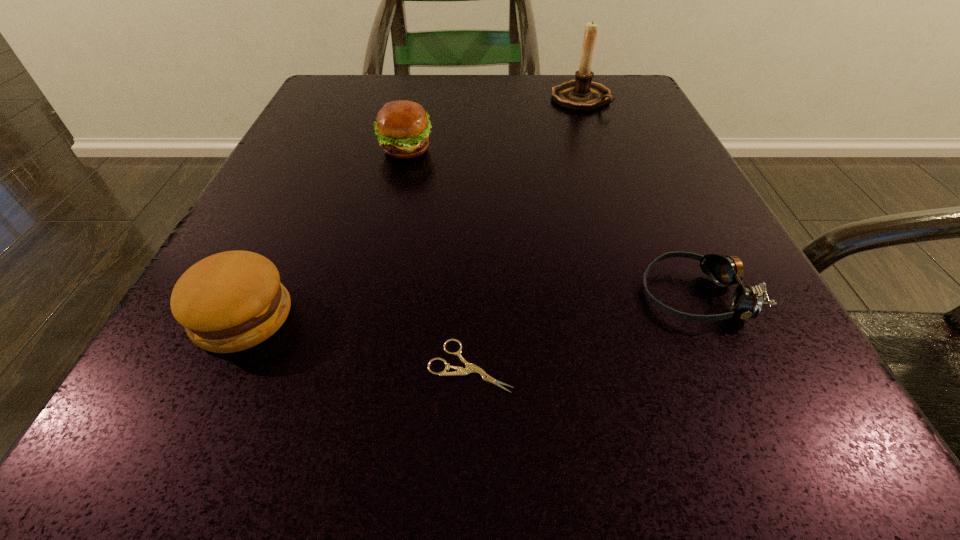
Image resolution: width=960 pixels, height=540 pixels. Identify the location of the tallest object. (581, 94).

In order to click on the farthest object in this screenshot , I will do (x=581, y=94).

You are a GUI agent. You are given a task and a screenshot of the screen. Output one action in this format:
    pyautogui.click(x=<x>, y=<y>)
    Task: Click on the second farthest object
    
    Given the screenshot: What is the action you would take?
    pyautogui.click(x=402, y=126)

Where is `the farther hamburger`? the farther hamburger is located at coordinates (402, 126).

The image size is (960, 540). I want to click on the nearer hamburger, so click(x=231, y=301).

Find the location of `the leftmost object`. the leftmost object is located at coordinates (231, 301).

This screenshot has width=960, height=540. I want to click on goggles, so click(x=746, y=302).

Find the location of a particular element. The width and height of the screenshot is (960, 540). shears is located at coordinates (x=470, y=368).

You are a GUI agent. You are given a task and a screenshot of the screen. Output one action in this format:
    pyautogui.click(x=<x>, y=<y>)
    Task: Click on the shortest object
    This screenshot has height=540, width=960.
    Given the screenshot: What is the action you would take?
    pyautogui.click(x=470, y=368)

Locate an element on the screen. This screenshot has height=540, width=960. free space located 0.330m on the front of the farthest object is located at coordinates (626, 224).